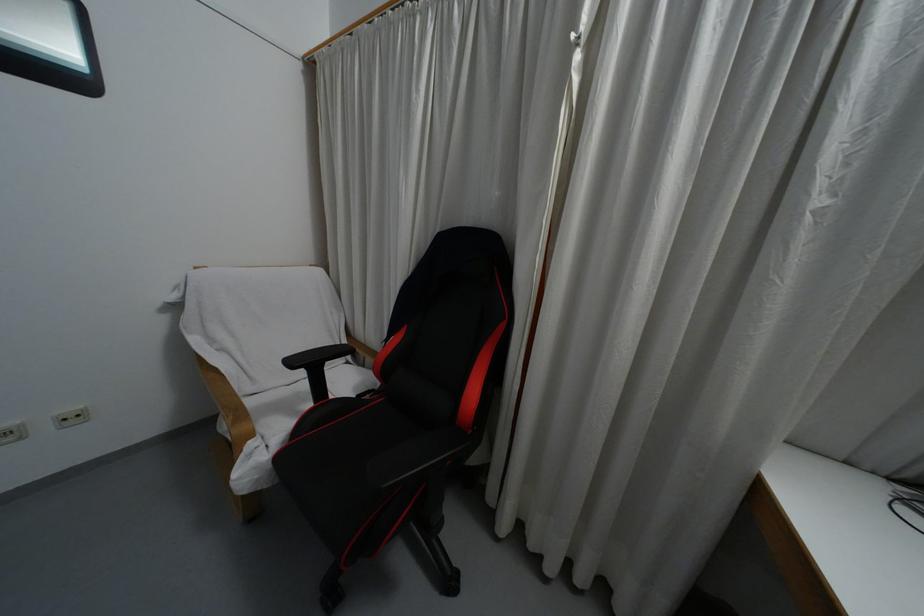
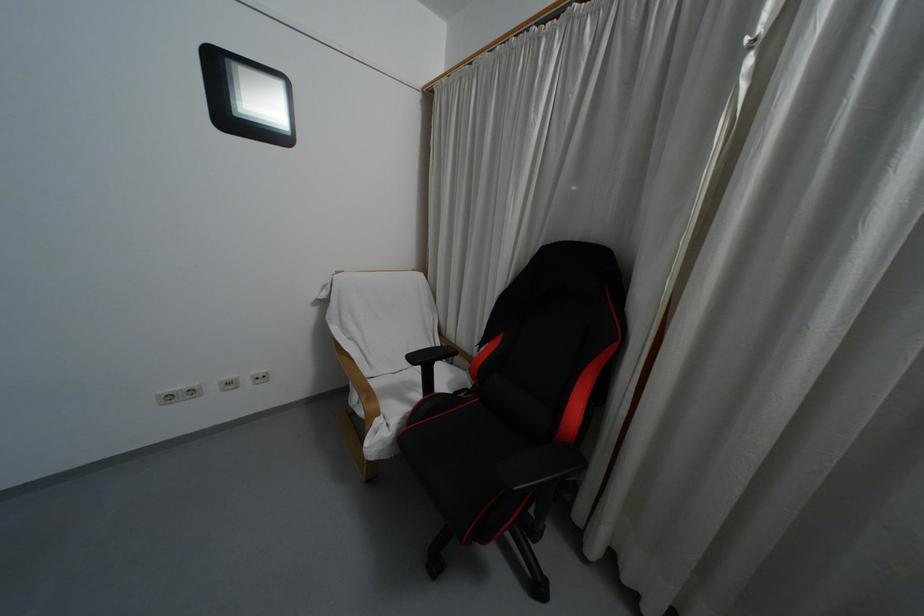
Question: Based on the continuous images, in which direction is the camera rotating? Reply with the corresponding letter.

Choices:
 (A) Left
 (B) Right
 (C) Up
 (D) Down

Answer: (A)